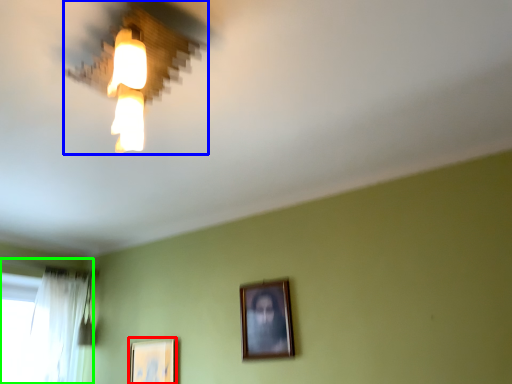
Question: Which object is the farthest from picture frame (highlighted by a red box)? Choose among these: lamp (highlighted by a blue box) or window (highlighted by a green box).

Choices:
 (A) lamp
 (B) window

Answer: (A)